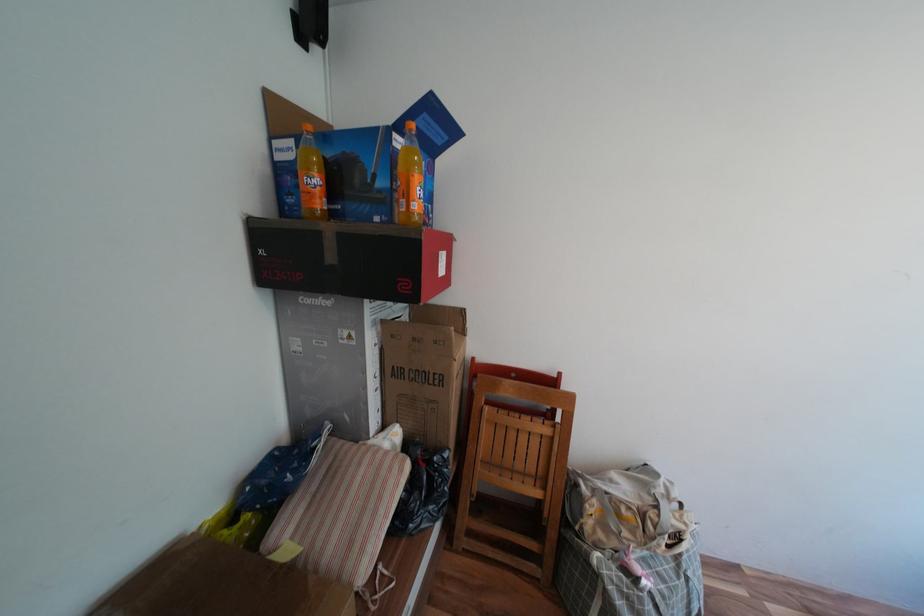
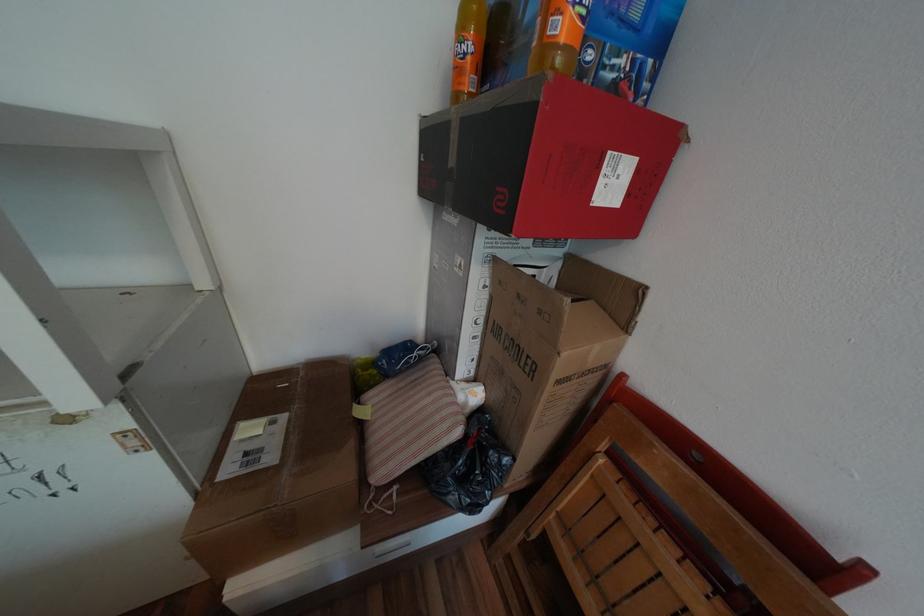
The point at (x=444, y=458) is marked in the first image. Where is the corresponding point in the second image?

(500, 453)